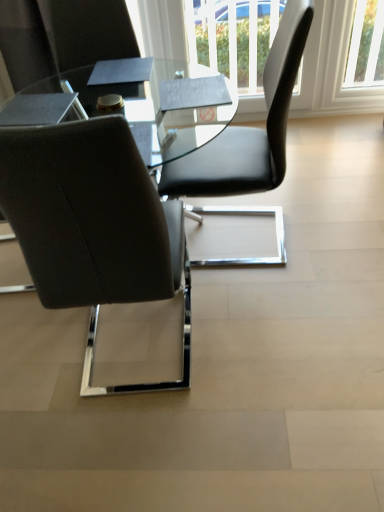
I want to click on vacant space that's between matte black chair at left, the 2th chair from the right, and transparent glass table at center, so click(x=141, y=349).